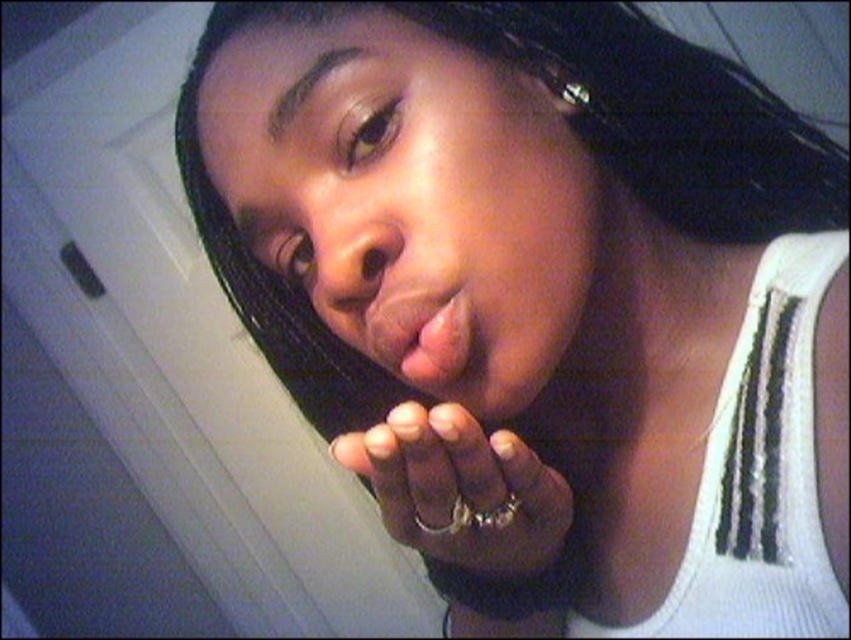
Where is `smooth skin face at center`? Image resolution: width=851 pixels, height=640 pixels. smooth skin face at center is located at coordinates (403, 195).

Consider the image. Who is more forward, (x=253, y=236) or (x=432, y=301)?

Point (x=432, y=301)

Is point (218, 54) closer to camera compared to point (406, 369)?

No, (218, 54) is behind (406, 369).

You are a GUI agent. You are given a task and a screenshot of the screen. Output one action in this format:
    pyautogui.click(x=<x>, y=<y>)
    Task: Click on the smooth skin face at center
    Image resolution: width=851 pixels, height=640 pixels.
    Given the screenshot: What is the action you would take?
    pyautogui.click(x=403, y=195)

Can you confirm if smooth skin face at center is wider than metallic ring at center?

Yes, smooth skin face at center is wider than metallic ring at center.

Who is taller, smooth skin face at center or metallic ring at center?

Standing taller between the two is smooth skin face at center.

Identify the location of smooth skin face at center. click(403, 195).

Is metallic ring at center closer to the viewer compared to matte pink lips at center?

Yes, it is.

In the scene shown: Is metallic ring at center thinner than matte pink lips at center?

No.

Where is `metallic ring at center`? This screenshot has height=640, width=851. metallic ring at center is located at coordinates (460, 490).

Where is `metallic ring at center`? The height and width of the screenshot is (640, 851). metallic ring at center is located at coordinates (460, 490).